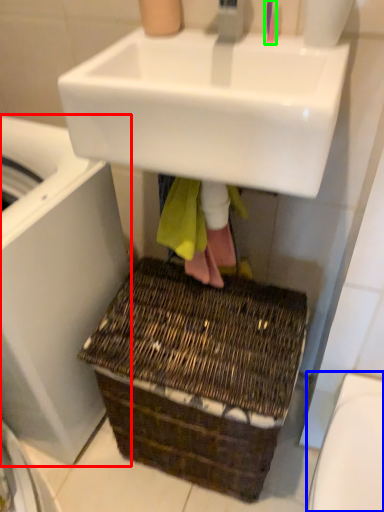
Question: Which object is positioned farthest from washing machine (highlighted by a red box)? Select from toilet bowl (highlighted by a blue box) and toothbrush (highlighted by a green box).

Choices:
 (A) toilet bowl
 (B) toothbrush

Answer: (B)